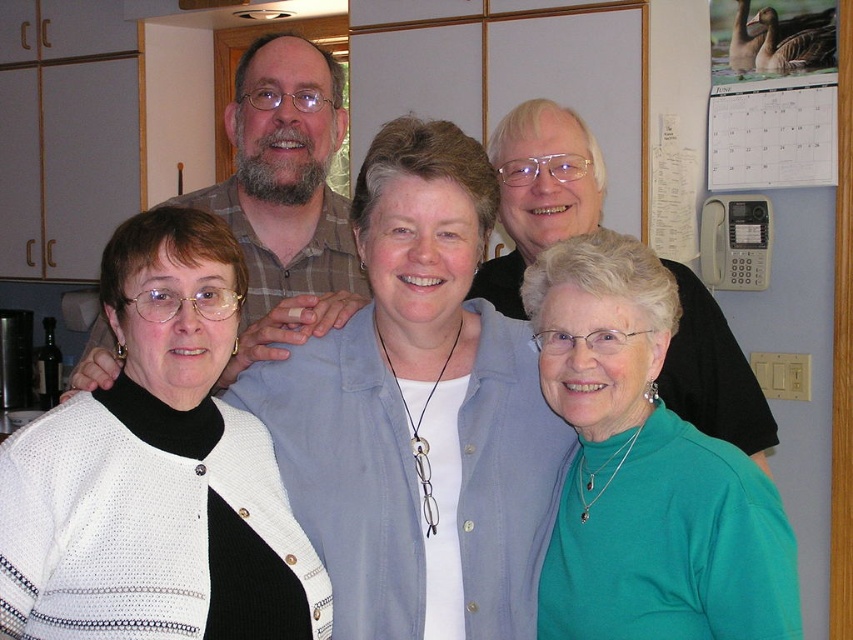
Describe the element at coordinates (645, 470) in the screenshot. I see `teal matte shirt at center` at that location.

Where is `teal matte shirt at center`? The width and height of the screenshot is (853, 640). teal matte shirt at center is located at coordinates (645, 470).

Is point (665, 273) positioned in front of point (300, 218)?

Yes, it is in front of point (300, 218).

I want to click on teal matte shirt at center, so click(645, 470).

What do you see at coordinates (155, 472) in the screenshot?
I see `white knitted cardigan at left` at bounding box center [155, 472].

Is white knitted cardigan at left wider than plaid shirt at center?

Incorrect, white knitted cardigan at left's width does not surpass plaid shirt at center's.

Which is in front, point (180, 538) or point (305, 42)?

Point (180, 538) is in front.

Locate an element on the screen. The width and height of the screenshot is (853, 640). white knitted cardigan at left is located at coordinates (155, 472).

Does light blue shirt at center have a larger size compared to white knitted cardigan at left?

Indeed, light blue shirt at center has a larger size compared to white knitted cardigan at left.

At what (x,y) coordinates should I click in order to perform the action: click on light blue shirt at center. Please return your answer as a coordinate pair (x, y). Looking at the image, I should click on coord(419,412).